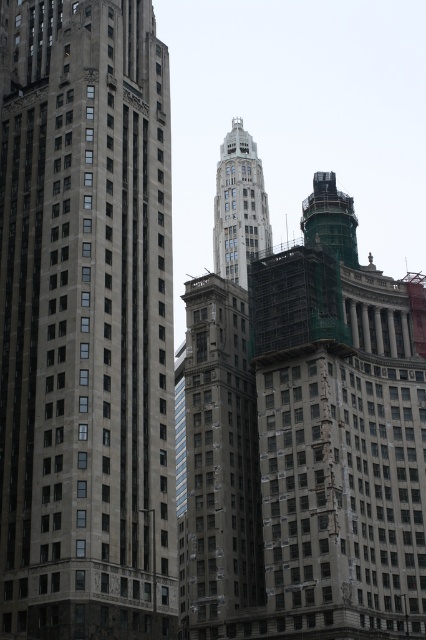
Between brown stone building at center and green glass tower at center, which one appears on the left side from the viewer's perspective?

brown stone building at center

Can you confirm if brown stone building at center is bigger than green glass tower at center?

Correct, brown stone building at center is larger in size than green glass tower at center.

At what (x,y) coordinates should I click in order to perform the action: click on brown stone building at center. Please return your answer as a coordinate pair (x, y). The height and width of the screenshot is (640, 426). Looking at the image, I should click on (215, 460).

Who is shorter, greenish concrete tower at center-right or brown stone building at center?

brown stone building at center

Which is below, greenish concrete tower at center-right or brown stone building at center?

Positioned lower is brown stone building at center.

What do you see at coordinates (339, 429) in the screenshot?
I see `greenish concrete tower at center-right` at bounding box center [339, 429].

Identify the location of greenish concrete tower at center-right. (339, 429).

Can you confirm if gray stone building at center is taller than brown stone building at center?

Indeed, gray stone building at center has a greater height compared to brown stone building at center.

Can you confirm if gray stone building at center is positioned to the right of brown stone building at center?

In fact, gray stone building at center is to the left of brown stone building at center.

You are a GUI agent. You are given a task and a screenshot of the screen. Output one action in this format:
    pyautogui.click(x=<x>, y=<y>)
    Task: Click on the gray stone building at center
    This screenshot has height=640, width=426.
    Given the screenshot: What is the action you would take?
    pyautogui.click(x=86, y=323)

The height and width of the screenshot is (640, 426). What are the coordinates of `gray stone building at center` in the screenshot? It's located at (86, 323).